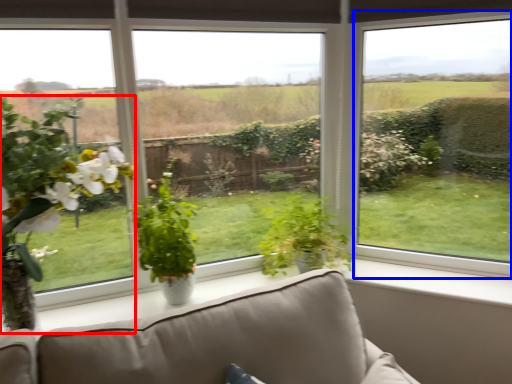
Question: Which of the following is the farthest to the observer, houseplant (highlighted by a red box) or window (highlighted by a blue box)?

Choices:
 (A) houseplant
 (B) window

Answer: (B)